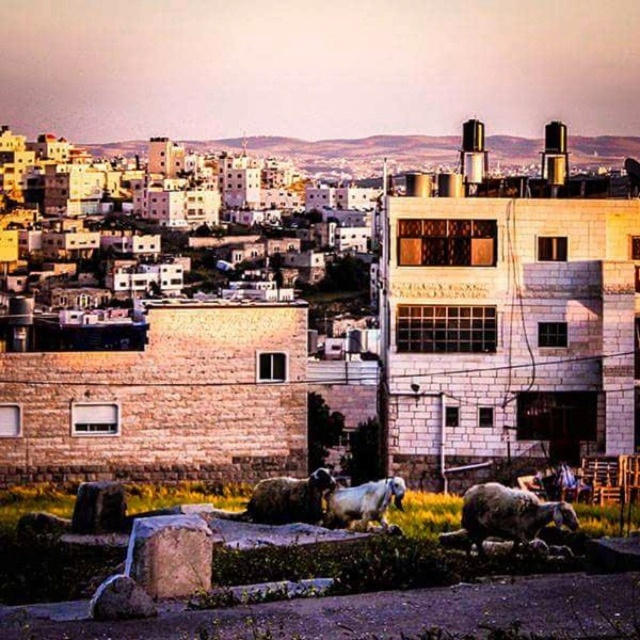
Question: Is brick stone buildings at upper center behind brown woolen sheep at center?

Choices:
 (A) no
 (B) yes

Answer: (B)

Question: Based on their relative distances, which object is farther from the white woolen sheep at lower right?

Choices:
 (A) white woolen sheep at lower center
 (B) brown woolen sheep at center
 (C) brick stone buildings at upper center

Answer: (C)

Question: Considering the relative positions of white woolen sheep at lower right and white woolen sheep at lower center in the image provided, where is white woolen sheep at lower right located with respect to white woolen sheep at lower center?

Choices:
 (A) right
 (B) left

Answer: (A)

Question: Which of the following is the closest to the observer?

Choices:
 (A) brick stone buildings at upper center
 (B) white woolen sheep at lower center
 (C) brown woolen sheep at center

Answer: (B)

Question: Is brick stone buildings at upper center below brown woolen sheep at center?

Choices:
 (A) yes
 (B) no

Answer: (B)

Question: Which of these objects is positioned farthest from the brick stone buildings at upper center?

Choices:
 (A) white woolen sheep at lower center
 (B) white woolen sheep at lower right
 (C) brown woolen sheep at center

Answer: (B)